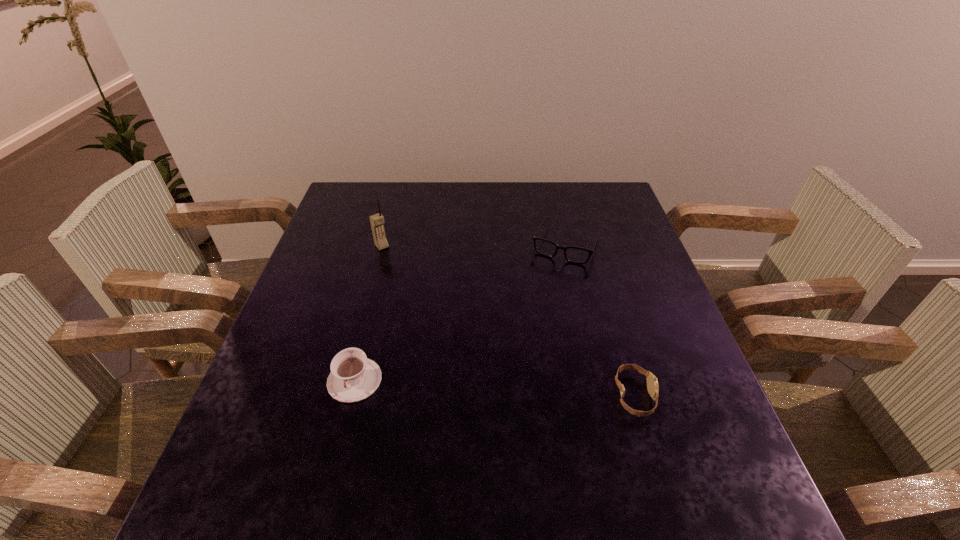
Where is `free space between the teacup and the watch`? The width and height of the screenshot is (960, 540). free space between the teacup and the watch is located at coordinates (494, 388).

Identify the location of free space between the watch and the spectacles. (600, 320).

Where is `unoccupied area between the tallest object and the teacup`? unoccupied area between the tallest object and the teacup is located at coordinates (369, 313).

You are a GUI agent. You are given a task and a screenshot of the screen. Output one action in this format:
    pyautogui.click(x=<x>, y=<y>)
    Task: Click on the vacant space that is in between the cellular telephone and the spectacles
    
    Given the screenshot: What is the action you would take?
    pyautogui.click(x=474, y=245)

Identify which object is located as the third nearest to the tallest object. Please provide its 2D coordinates. Your answer should be formatted as a tuple, i.e. [(x, y)], where the tuple contains the x and y coordinates of a point satisfying the conditions above.

[(652, 383)]

Locate which object is the third closest to the teacup. Please provide its 2D coordinates. Your answer should be formatted as a tuple, i.e. [(x, y)], where the tuple contains the x and y coordinates of a point satisfying the conditions above.

[(652, 383)]

The width and height of the screenshot is (960, 540). In order to click on vacant space that satisfies the following two spatial constraints: 1. on the handle side of the watch; 2. on the face of the teacup in this screenshot , I will do `click(351, 396)`.

Find the location of a particular element. The image size is (960, 540). free spot that satisfies the following two spatial constraints: 1. on the handle side of the watch; 2. on the face of the teacup is located at coordinates (351, 396).

At what (x,y) coordinates should I click in order to perform the action: click on free space that satisfies the following two spatial constraints: 1. on the back side of the tallest object; 2. on the right side of the spectacles. Please return your answer as a coordinate pair (x, y). This screenshot has height=540, width=960. Looking at the image, I should click on (383, 244).

Image resolution: width=960 pixels, height=540 pixels. Find the location of `free location that satisfies the following two spatial constraints: 1. on the front side of the watch; 2. on the face of the tallest object`. free location that satisfies the following two spatial constraints: 1. on the front side of the watch; 2. on the face of the tallest object is located at coordinates (342, 396).